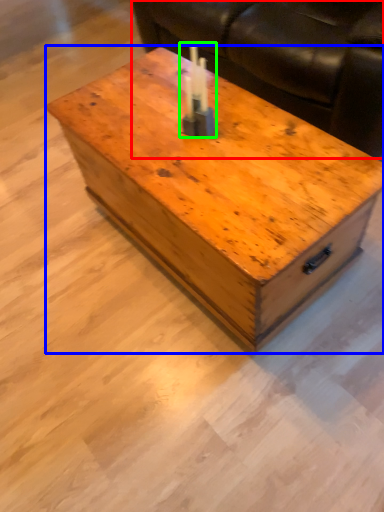
Question: Which object is the farthest from couch (highlighted by a red box)? Choose among these: coffee table (highlighted by a blue box) or birthday candle (highlighted by a green box).

Choices:
 (A) coffee table
 (B) birthday candle

Answer: (B)